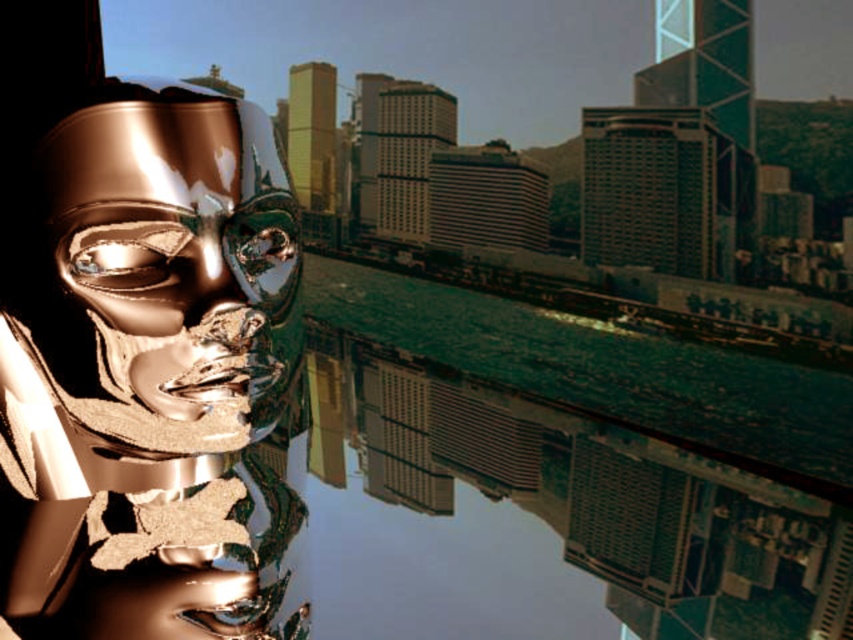
Is green reflective water at center smaller than shiny gold mask at center?

No.

Does green reflective water at center appear on the right side of shiny gold mask at center?

Correct, you'll find green reflective water at center to the right of shiny gold mask at center.

Locate an element on the screen. green reflective water at center is located at coordinates (543, 476).